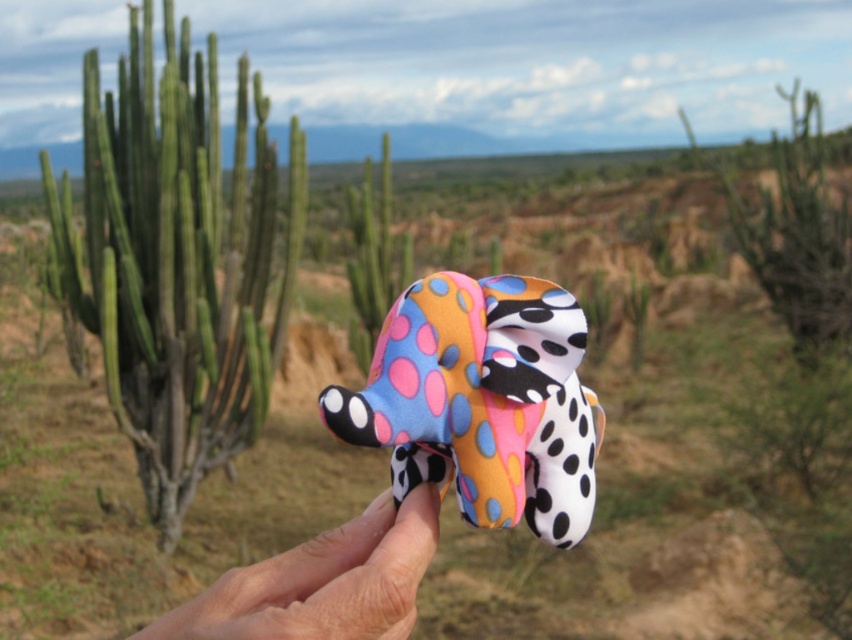
How distant is green matte cactus at left from polka dot fabric elephant at center?

They are 10.81 feet apart.

Does green matte cactus at left have a larger size compared to polka dot fabric elephant at center?

Indeed, green matte cactus at left has a larger size compared to polka dot fabric elephant at center.

Is point (55, 227) in front of point (573, 524)?

No, (55, 227) is further to viewer.

This screenshot has height=640, width=852. I want to click on green matte cactus at left, so click(x=174, y=262).

From the picture: Does polka dot fabric elephant at center come in front of smooth skin hand at center?

No, polka dot fabric elephant at center is further to the viewer.

Between polka dot fabric elephant at center and smooth skin hand at center, which one appears on the left side from the viewer's perspective?

smooth skin hand at center

The image size is (852, 640). What do you see at coordinates (482, 401) in the screenshot? I see `polka dot fabric elephant at center` at bounding box center [482, 401].

Identify the location of polka dot fabric elephant at center. (482, 401).

Which is in front, point (204, 168) or point (327, 547)?

Point (327, 547) is more forward.

Is point (76, 314) in front of point (177, 628)?

That is False.

The height and width of the screenshot is (640, 852). In order to click on green matte cactus at left in this screenshot , I will do click(174, 262).